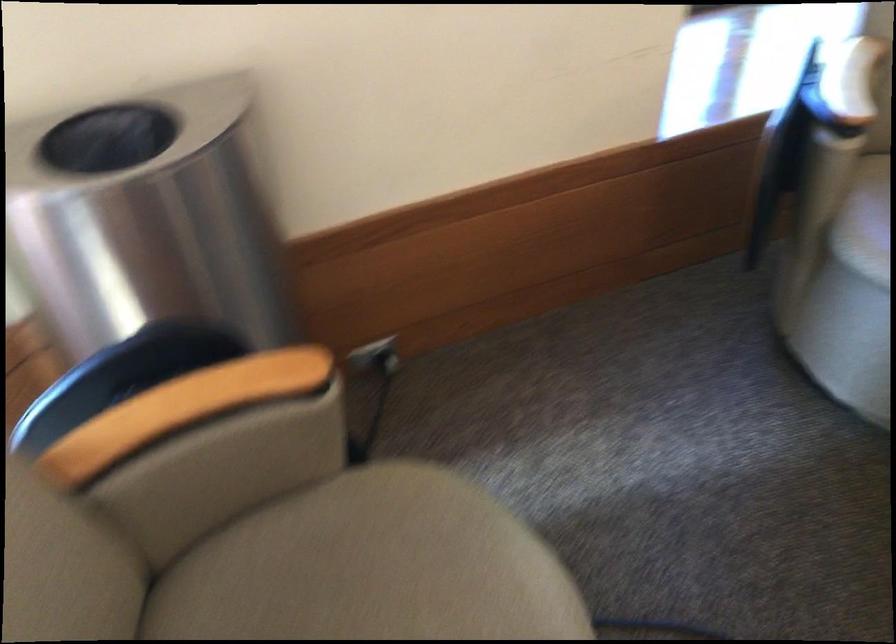
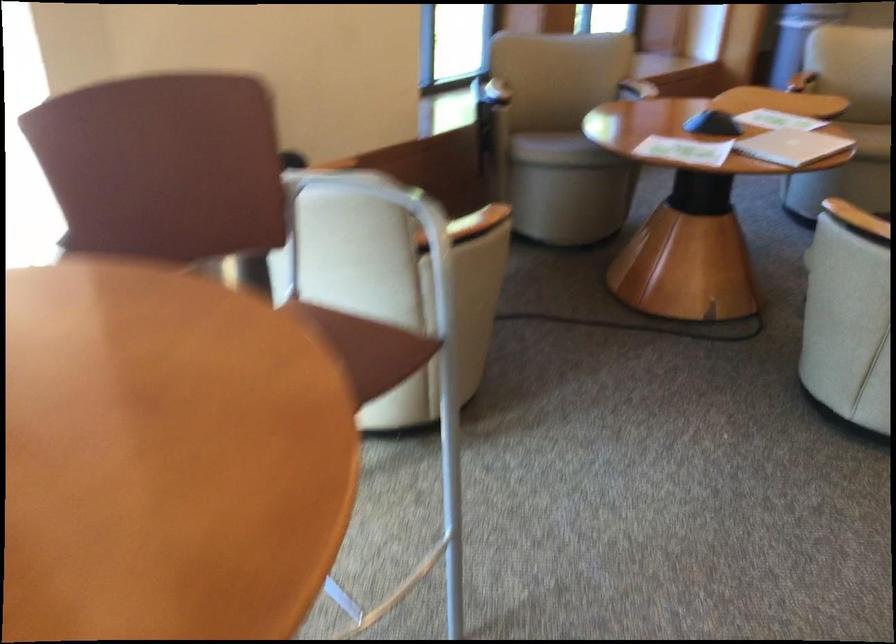
Which direction would the cameraman need to move to produce the second image?

The cameraman walked toward left, backward.